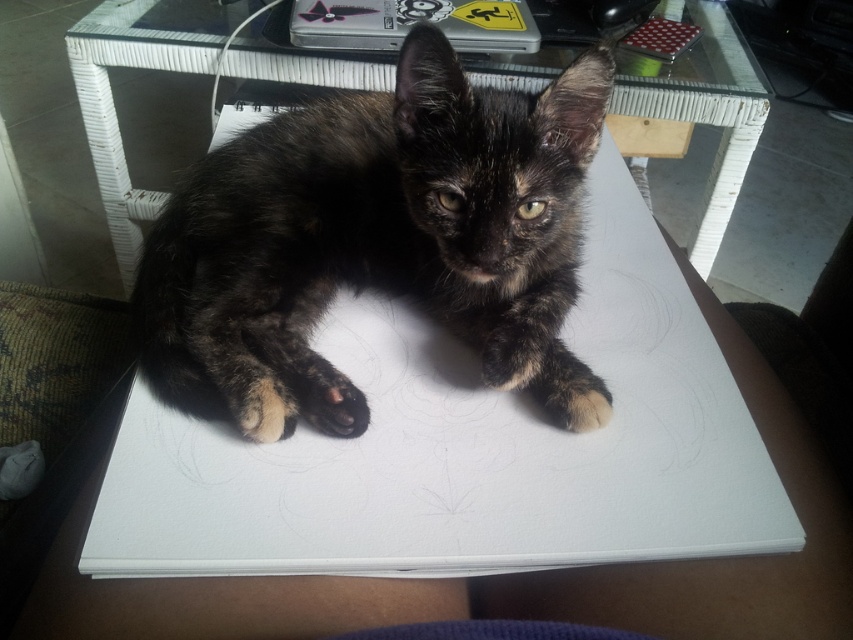
Which is above, transparent glass table at center or dark brown fur paw at center?

transparent glass table at center is above.

Can you confirm if transparent glass table at center is thinner than dark brown fur paw at center?

No, transparent glass table at center is not thinner than dark brown fur paw at center.

I want to click on transparent glass table at center, so click(695, 113).

Can you confirm if dark tortoiseshell fur at center is thinner than transparent glass table at center?

Yes, dark tortoiseshell fur at center is thinner than transparent glass table at center.

Where is `dark tortoiseshell fur at center`? dark tortoiseshell fur at center is located at coordinates (379, 236).

Does dark tortoiseshell fur at center appear over dark brown fur paw at center?

Indeed, dark tortoiseshell fur at center is positioned over dark brown fur paw at center.

Is point (135, 296) behind point (325, 426)?

That is True.

Is point (549, 253) in front of point (334, 368)?

No, it is not.

Locate an element on the screen. dark tortoiseshell fur at center is located at coordinates (379, 236).